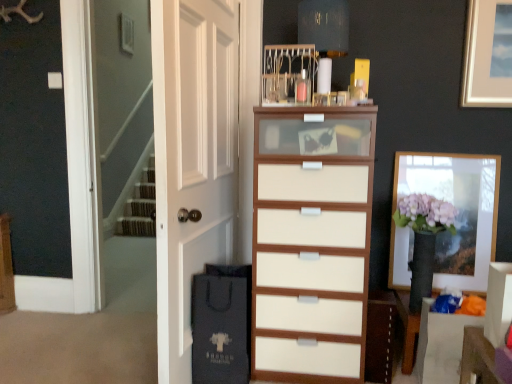
Question: Considering the positions of point (233, 276) and point (370, 299), is point (233, 276) closer or farther from the camera than point (370, 299)?

Choices:
 (A) closer
 (B) farther

Answer: (A)

Question: In terms of height, does matte black shopping bag at lower left look taller or shorter compared to white wood cabinet at center?

Choices:
 (A) tall
 (B) short

Answer: (A)

Question: Estimate the real-world distances between objects in this image. Which object is farther from the white glossy drawer at lower right?

Choices:
 (A) white matte door at center
 (B) wooden picture frame at right
 (C) white wood chest of drawers at center
 (D) white wood cabinet at center
 (E) matte black shopping bag at lower left

Answer: (A)

Question: Which object is the farthest from the white glossy drawer at lower right?

Choices:
 (A) white wood chest of drawers at center
 (B) matte black shopping bag at lower left
 (C) wooden picture frame at right
 (D) white wood cabinet at center
 (E) white matte door at center

Answer: (E)